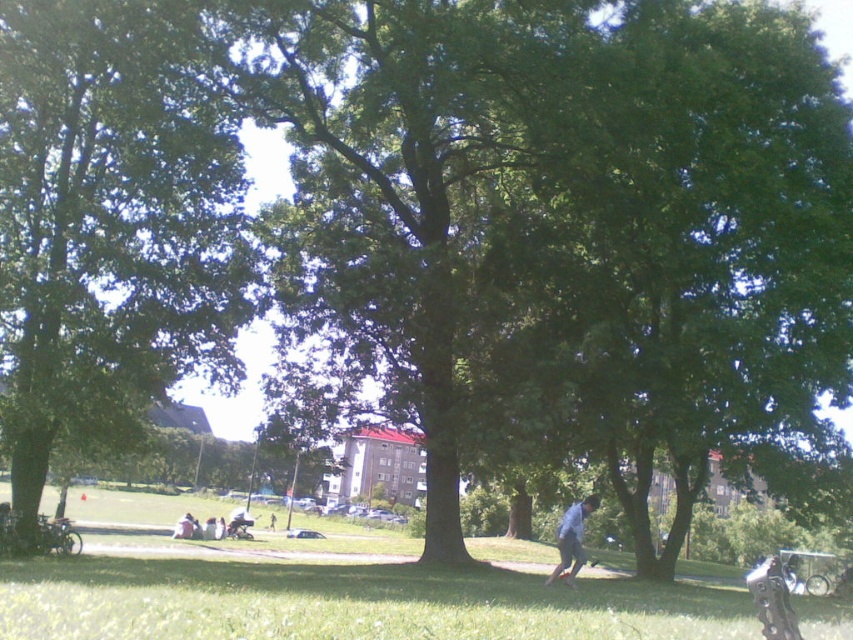
This screenshot has width=853, height=640. What do you see at coordinates (334, 589) in the screenshot?
I see `green grass at lower center` at bounding box center [334, 589].

Does point (90, 612) lie in front of point (590, 508)?

Yes.

Which is in front, point (732, 627) or point (584, 500)?

Point (732, 627)

Identify the location of green grass at lower center. (334, 589).

Is green leafy tree at left wider than light brown leather jacket at lower center?

Yes, green leafy tree at left is wider than light brown leather jacket at lower center.

Is point (79, 310) closer to camera compared to point (186, 515)?

Yes, it is in front of point (186, 515).

Who is more distant from viewer, (144, 310) or (177, 529)?

The point (177, 529) is more distant.

Where is `green leafy tree at left`? green leafy tree at left is located at coordinates (108, 221).

Does green grass at lower center appear on the right side of dark blue jeans at center?

Correct, you'll find green grass at lower center to the right of dark blue jeans at center.

In the scene shown: Who is lower down, green grass at lower center or dark blue jeans at center?

dark blue jeans at center is below.

Is point (4, 636) in front of point (273, 515)?

Yes, it is in front of point (273, 515).

The height and width of the screenshot is (640, 853). I want to click on green grass at lower center, so click(334, 589).